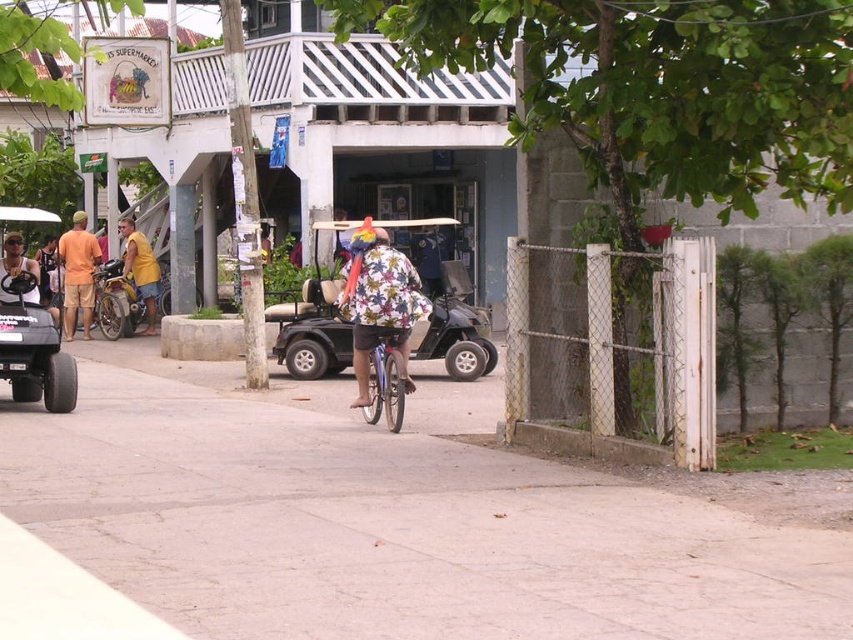
Question: Considering the real-world distances, which object is farthest from the metallic blue bicycle at center?

Choices:
 (A) black plastic golf cart at left
 (B) matte orange shirt at left
 (C) yellow cotton shirt at left

Answer: (C)

Question: Which is nearer to the metallic blue bicycle at center?

Choices:
 (A) matte black golf cart at left
 (B) floral fabric shirt at center
 (C) metallic gray golf cart at center
 (D) gray concrete pavement at center

Answer: (B)

Question: Which object is positioned farthest from the yellow cotton shirt at left?

Choices:
 (A) metallic blue bicycle at center
 (B) black plastic golf cart at left
 (C) gray concrete pavement at center

Answer: (A)

Question: Can you confirm if metallic gray golf cart at center is positioned below floral fabric shirt at center?

Choices:
 (A) no
 (B) yes

Answer: (B)

Question: Does gray concrete pavement at center appear under matte orange shirt at left?

Choices:
 (A) no
 (B) yes

Answer: (B)

Question: Can you confirm if floral fabric shirt at center is thinner than matte black golf cart at left?

Choices:
 (A) no
 (B) yes

Answer: (A)